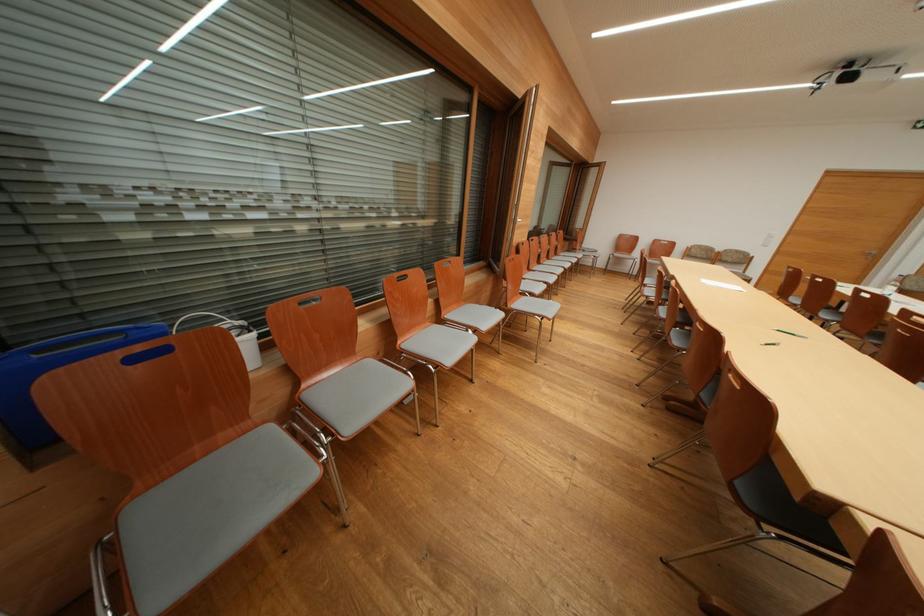
At what (x,y) coordinates should I click in order to perform the action: click on green pen. Please return your answer as a coordinate pair (x, y). This screenshot has height=616, width=924. Looking at the image, I should click on pyautogui.click(x=789, y=333).